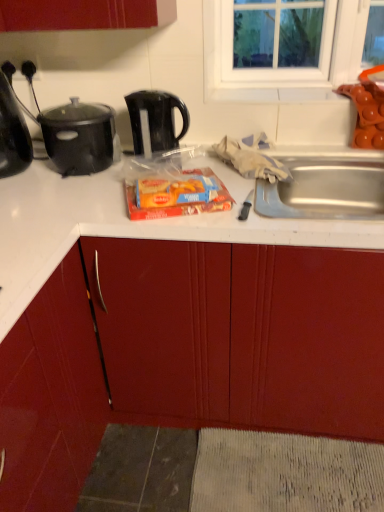
Where is `vacant space that is in between shiny black kettle at left and black matte pot at upper left`? vacant space that is in between shiny black kettle at left and black matte pot at upper left is located at coordinates (45, 178).